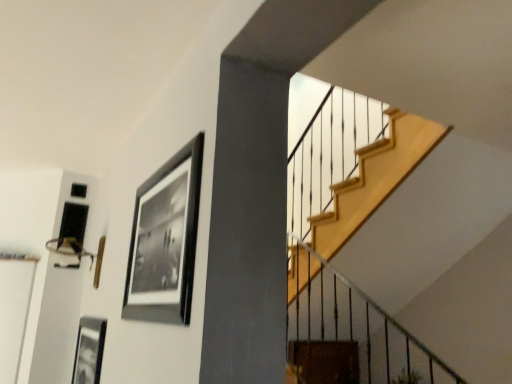
Question: Can we say black matte picture frame at upper left, positioned as the 2th picture frame in left-to-right order, lies outside black matte picture frame at lower left, which ranks as the second picture frame in right-to-left order?

Choices:
 (A) no
 (B) yes

Answer: (B)

Question: Is black matte picture frame at upper left, which ranks as the first picture frame in front-to-back order, directly adjacent to black matte picture frame at lower left, arranged as the 1th picture frame when ordered from the bottom?

Choices:
 (A) no
 (B) yes

Answer: (A)

Question: Is black matte picture frame at upper left, which ranks as the first picture frame in front-to-back order, facing towards black matte picture frame at lower left, marked as the 2th picture frame in a front-to-back arrangement?

Choices:
 (A) yes
 (B) no

Answer: (B)

Question: Would you say black matte picture frame at upper left, which ranks as the first picture frame in right-to-left order, is a long distance from black matte picture frame at lower left, which is counted as the 1th picture frame, starting from the back?

Choices:
 (A) no
 (B) yes

Answer: (A)

Question: Does black matte picture frame at upper left, positioned as the 2th picture frame in left-to-right order, have a lesser height compared to black matte picture frame at lower left, arranged as the 1th picture frame when ordered from the bottom?

Choices:
 (A) no
 (B) yes

Answer: (A)

Question: From a real-world perspective, is black matte picture frame at upper left, placed as the second picture frame when sorted from back to front, below black matte picture frame at lower left, arranged as the 1th picture frame when ordered from the bottom?

Choices:
 (A) no
 (B) yes

Answer: (A)

Question: Considering the relative positions of black matte picture frame at lower left, which ranks as the second picture frame in right-to-left order, and black matte picture frame at upper left, positioned as the 2th picture frame in left-to-right order, in the image provided, is black matte picture frame at lower left, which ranks as the second picture frame in right-to-left order, to the left of black matte picture frame at upper left, positioned as the 2th picture frame in left-to-right order, from the viewer's perspective?

Choices:
 (A) yes
 (B) no

Answer: (A)

Question: Considering the relative sizes of black matte picture frame at lower left, which is counted as the 1th picture frame, starting from the back, and black matte picture frame at upper left, placed as the second picture frame when sorted from back to front, in the image provided, is black matte picture frame at lower left, which is counted as the 1th picture frame, starting from the back, bigger than black matte picture frame at upper left, placed as the second picture frame when sorted from back to front,?

Choices:
 (A) no
 (B) yes

Answer: (A)

Question: Considering the relative sizes of black matte picture frame at lower left, arranged as the 1th picture frame when ordered from the bottom, and black matte picture frame at upper left, positioned as the 2th picture frame in left-to-right order, in the image provided, is black matte picture frame at lower left, arranged as the 1th picture frame when ordered from the bottom, smaller than black matte picture frame at upper left, positioned as the 2th picture frame in left-to-right order,?

Choices:
 (A) no
 (B) yes

Answer: (B)

Question: Is black matte picture frame at lower left, which is counted as the 1th picture frame, starting from the back, aimed at black matte picture frame at upper left, positioned as the 2th picture frame in left-to-right order?

Choices:
 (A) no
 (B) yes

Answer: (A)

Question: Are black matte picture frame at lower left, placed as the 1th picture frame when sorted from left to right, and black matte picture frame at upper left, which ranks as the first picture frame in right-to-left order, beside each other?

Choices:
 (A) yes
 (B) no

Answer: (B)

Question: Is black matte picture frame at lower left, placed as the 1th picture frame when sorted from left to right, in front of black matte picture frame at upper left, which ranks as the second picture frame in bottom-to-top order?

Choices:
 (A) no
 (B) yes

Answer: (A)

Question: Is black matte picture frame at upper left, which ranks as the first picture frame in front-to-back order, wider or thinner than black matte picture frame at lower left, arranged as the 1th picture frame when ordered from the bottom?

Choices:
 (A) wide
 (B) thin

Answer: (A)